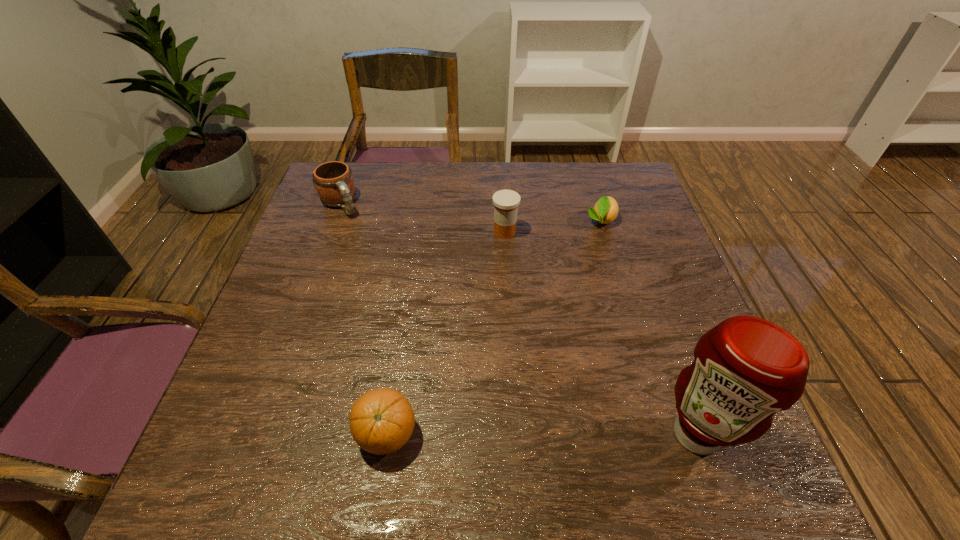
Image resolution: width=960 pixels, height=540 pixels. Find the location of `the third closest object relative to the third object from left to right`. the third closest object relative to the third object from left to right is located at coordinates (382, 420).

Identify which object is the third closest to the orange. Please provide its 2D coordinates. Your answer should be formatted as a tuple, i.e. [(x, y)], where the tuple contains the x and y coordinates of a point satisfying the conditions above.

[(334, 183)]

Image resolution: width=960 pixels, height=540 pixels. Identify the location of free spot that satisfies the following two spatial constraints: 1. on the back side of the second object from left to right; 2. on the left side of the third object from right to left. (418, 232).